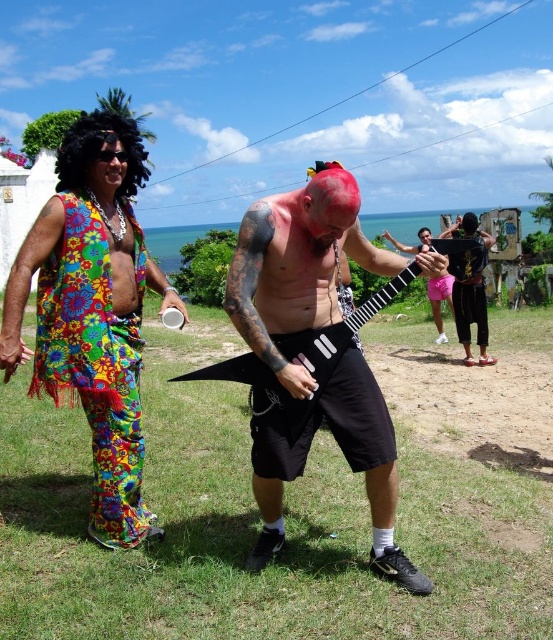
Which of these two, black curly wig at upper left or black leather jacket at lower right, stands shorter?

black leather jacket at lower right

Can you confirm if black curly wig at upper left is positioned to the right of black leather jacket at lower right?

No, black curly wig at upper left is not to the right of black leather jacket at lower right.

Between point (72, 129) and point (457, 259), which one is positioned in front?

Positioned in front is point (72, 129).

Identify the location of black curly wig at upper left. (100, 148).

Identify the location of floral fabric vest at left. The width and height of the screenshot is (553, 640). (96, 362).

Looking at this image, does floral fabric vest at left have a greater width compared to black curly wig at upper left?

No, floral fabric vest at left is not wider than black curly wig at upper left.

Is point (88, 397) closer to camera compared to point (82, 113)?

Yes.

Identify the location of floral fabric vest at left. Image resolution: width=553 pixels, height=640 pixels. (96, 362).

The image size is (553, 640). Describe the element at coordinates (300, 360) in the screenshot. I see `shiny black shorts at center` at that location.

Between point (260, 477) and point (442, 288), which one is positioned behind?

Point (442, 288)

The height and width of the screenshot is (640, 553). Identify the location of shiny black shorts at center. (300, 360).